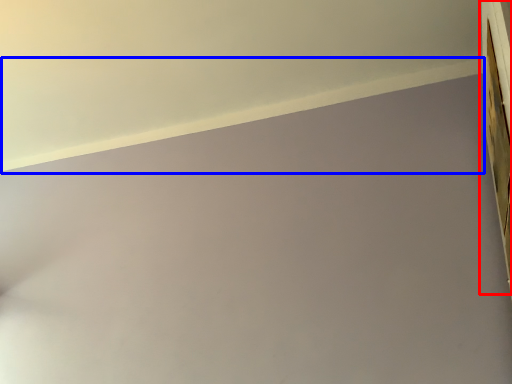
Question: Which object is closer to the camera taking this photo, window frame (highlighted by a red box) or window sill (highlighted by a blue box)?

Choices:
 (A) window frame
 (B) window sill

Answer: (B)